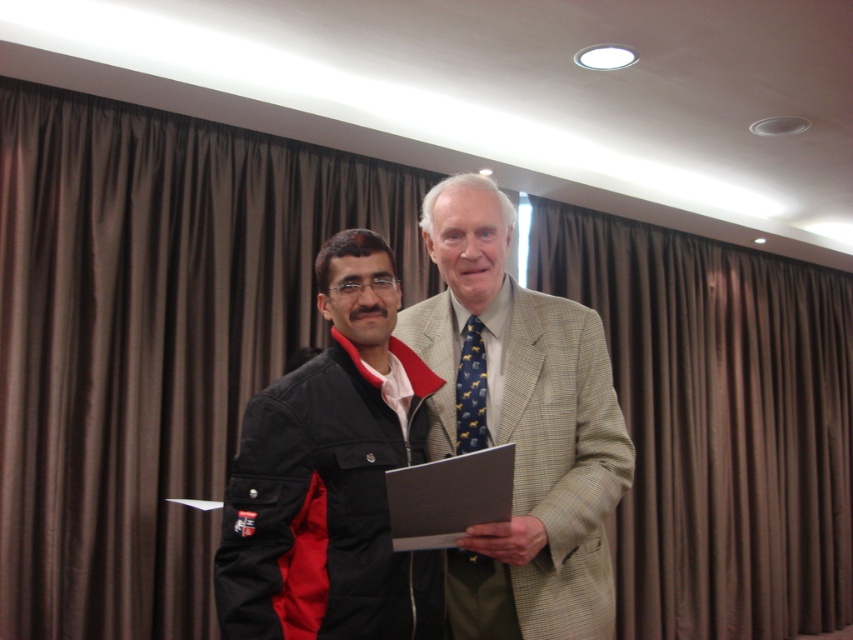
Question: Which is nearer to the black fabric jacket at center?

Choices:
 (A) blue patterned tie at center
 (B) light beige textured suit at center

Answer: (B)

Question: Observing the image, what is the correct spatial positioning of black fabric jacket at center in reference to blue patterned tie at center?

Choices:
 (A) below
 (B) above

Answer: (A)

Question: Based on their relative distances, which object is farther from the blue patterned tie at center?

Choices:
 (A) black fabric jacket at center
 (B) light beige textured suit at center

Answer: (A)

Question: Is light beige textured suit at center to the left of blue patterned tie at center from the viewer's perspective?

Choices:
 (A) yes
 (B) no

Answer: (B)

Question: Which of the following is the farthest from the observer?

Choices:
 (A) blue patterned tie at center
 (B) light beige textured suit at center
 (C) black fabric jacket at center

Answer: (A)

Question: In this image, where is black fabric jacket at center located relative to blue patterned tie at center?

Choices:
 (A) below
 (B) above

Answer: (A)